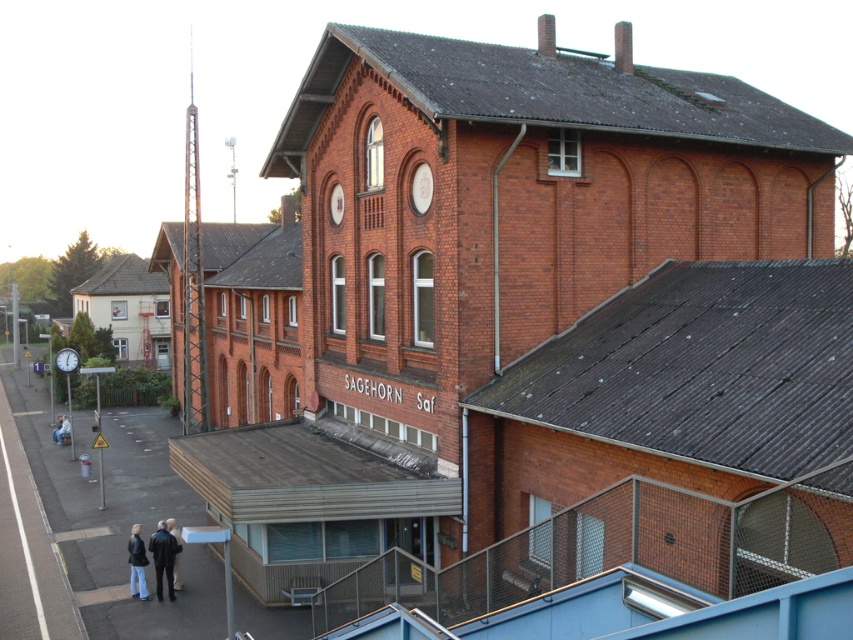
Question: Which object appears closest to the camera in this image?

Choices:
 (A) dark blue leather jacket at lower left
 (B) denim jacket at lower left

Answer: (A)

Question: Can you confirm if metallic round clock at upper left is positioned to the right of denim jacket at lower left?

Choices:
 (A) no
 (B) yes

Answer: (B)

Question: Is dark blue leather jacket at lower left further to the viewer compared to dark gray jacket at lower center?

Choices:
 (A) no
 (B) yes

Answer: (A)

Question: Is dark blue leather jacket at lower left below dark gray jacket at lower center?

Choices:
 (A) no
 (B) yes

Answer: (B)

Question: Which is nearer to the metallic round clock at upper left?

Choices:
 (A) dark gray jacket at lower center
 (B) dark blue jacket at lower center

Answer: (A)

Question: Which of the following is the closest to the observer?

Choices:
 (A) dark blue jacket at lower center
 (B) denim jacket at lower left
 (C) metallic round clock at upper left
 (D) dark blue leather jacket at lower left

Answer: (D)